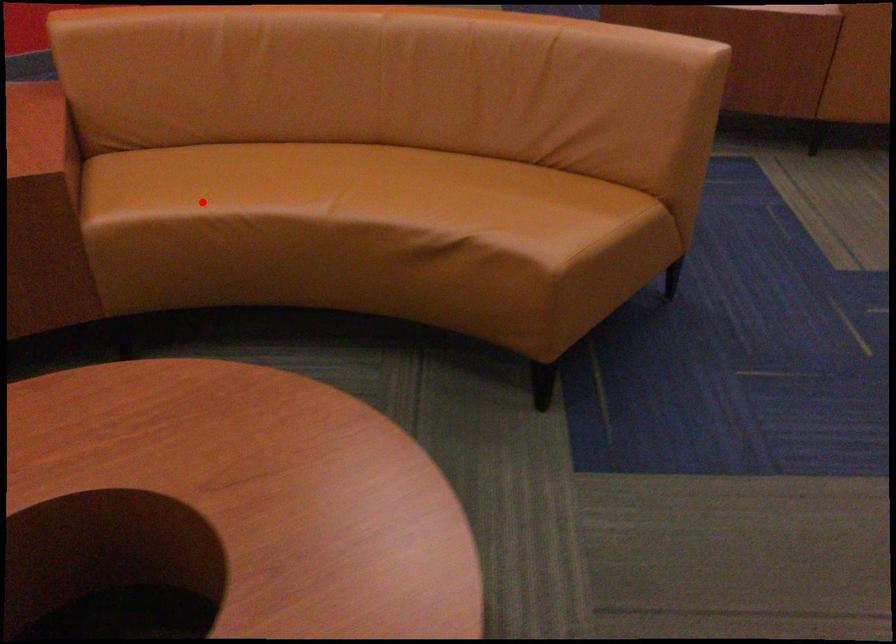
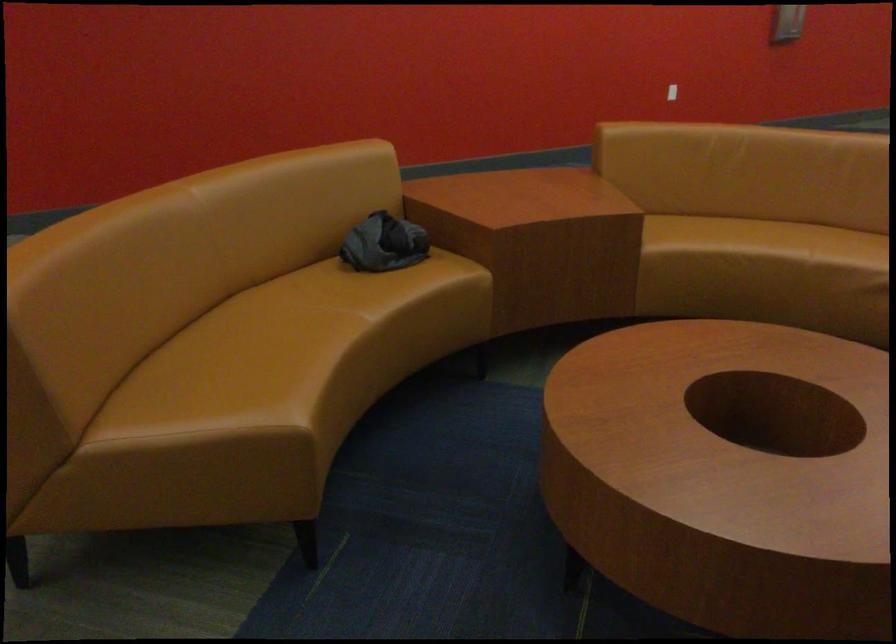
Where in the second image is the point corresponding to the highlighted location from the first image?

(719, 242)